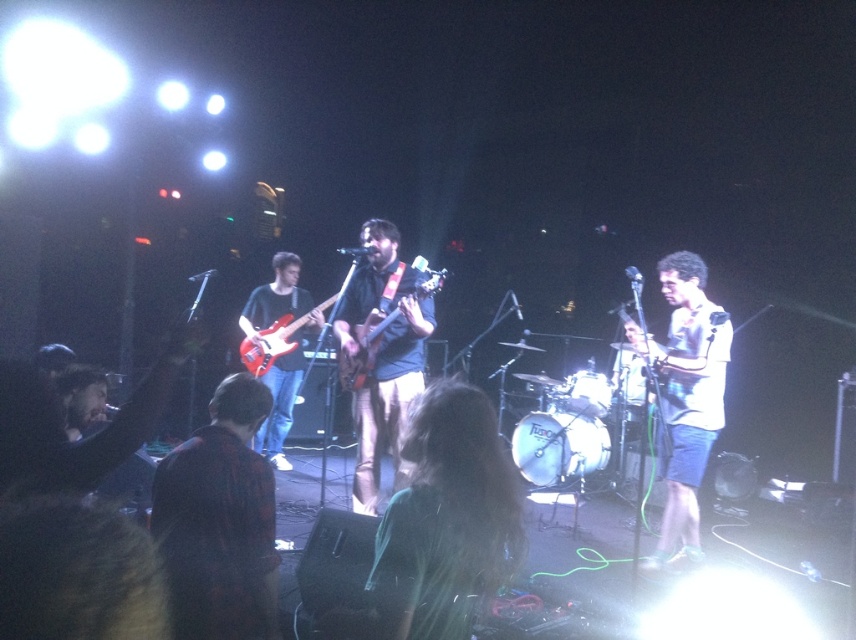
Who is more distant from viewer, (437,472) or (224,422)?

The point (224,422) is more distant.

Find the location of a particular element. The height and width of the screenshot is (640, 856). green fabric shirt at center is located at coordinates (446, 520).

Can you confirm if plaid shirt at center is positioned to the left of white matte shirt at center?

Indeed, plaid shirt at center is positioned on the left side of white matte shirt at center.

Image resolution: width=856 pixels, height=640 pixels. I want to click on plaid shirt at center, so click(220, 522).

Who is more distant from viewer, (450,448) or (629,356)?

The point (629,356) is more distant.

Find the location of a particular element. This screenshot has height=640, width=856. green fabric shirt at center is located at coordinates (446, 520).